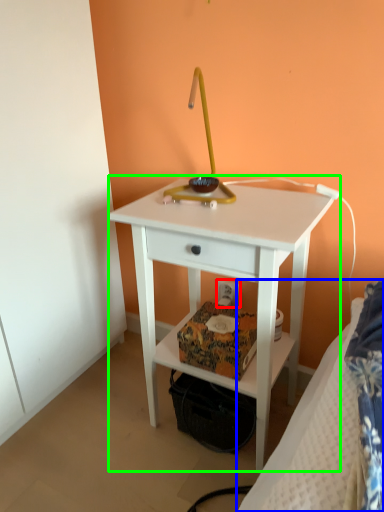
Question: Considering the real-world distances, which object is farthest from electric outlet (highlighted by a red box)? bed (highlighted by a blue box) or nightstand (highlighted by a green box)?

Choices:
 (A) bed
 (B) nightstand

Answer: (A)